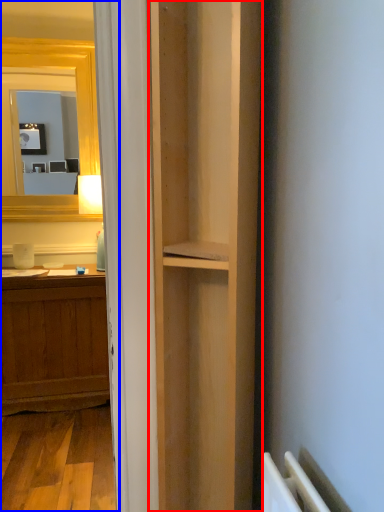
Question: Which object is closer to the camera taking this photo, bookshelf (highlighted by a red box) or corridor (highlighted by a blue box)?

Choices:
 (A) bookshelf
 (B) corridor

Answer: (A)